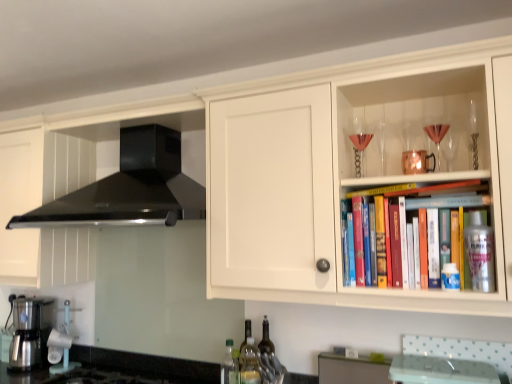
Question: From the image's perspective, relative to black matte range hood at upper left, is metallic silver coffee maker at lower left above or below?

Choices:
 (A) below
 (B) above

Answer: (A)

Question: Is metallic silver coffee maker at lower left in front of or behind black matte range hood at upper left in the image?

Choices:
 (A) behind
 (B) front

Answer: (A)

Question: Which of these objects is positioned closest to the matte gray cabinet at lower center, the first cabinetry in the back-to-front sequence?

Choices:
 (A) green plastic bottle at lower center, the second bottle when ordered from front to back
 (B) clear glass wine glass at upper right, the first wine glass positioned from the left
 (C) black matte range hood at upper left
 (D) metallic silver spray can at upper right, arranged as the 1th bottle when viewed from the front
 (E) black granite countertop at lower left

Answer: (A)

Question: Estimate the real-world distances between objects in this image. Which object is closer to the clear glass wine glass at upper right, the first wine glass positioned from the back?

Choices:
 (A) black matte range hood at upper left
 (B) translucent glass bottle at lower center, acting as the 4th bottle starting from the front
 (C) metallic silver coffee maker at lower left
 (D) matte gray cabinet at lower center, acting as the 2th cabinetry starting from the front
 (E) green plastic bottle at lower center, which ranks as the 3th bottle in back-to-front order

Answer: (D)